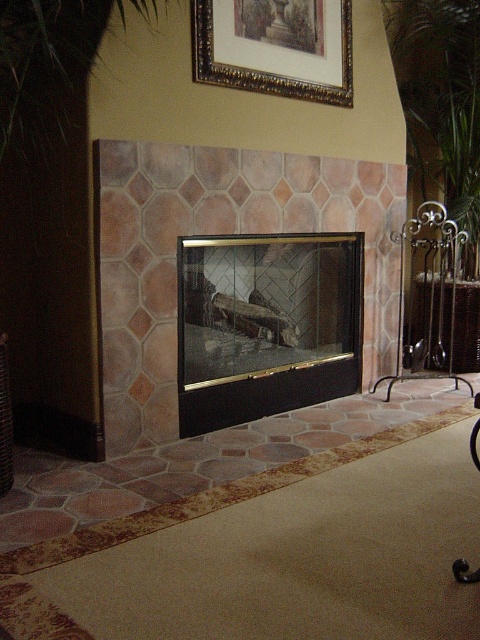
You are standing in the living room and want to hang a new picture above the rustic stone fireplace at center. Is there enough space between the fireplace and the green leafy plant at right to place it?

The rustic stone fireplace at center is located below the green leafy plant at right, so there is space between them to place the new picture above the fireplace.

You are arranging a living room and want to place a new sofa between the black glass fireplace at center and the green leafy plant at right. Based on their positions, which side of the sofa should face the fireplace?

The black glass fireplace at center is positioned on the left side of the green leafy plant at right. Therefore, the left side of the sofa should face the fireplace.

You are planning to place a decorative item on the mantel of the black glass fireplace at center. Considering the size of the green leafy plant at right, will the mantel have enough space to accommodate it?

The black glass fireplace at center is wider than the green leafy plant at right, so the mantel likely has enough space to accommodate the plant.